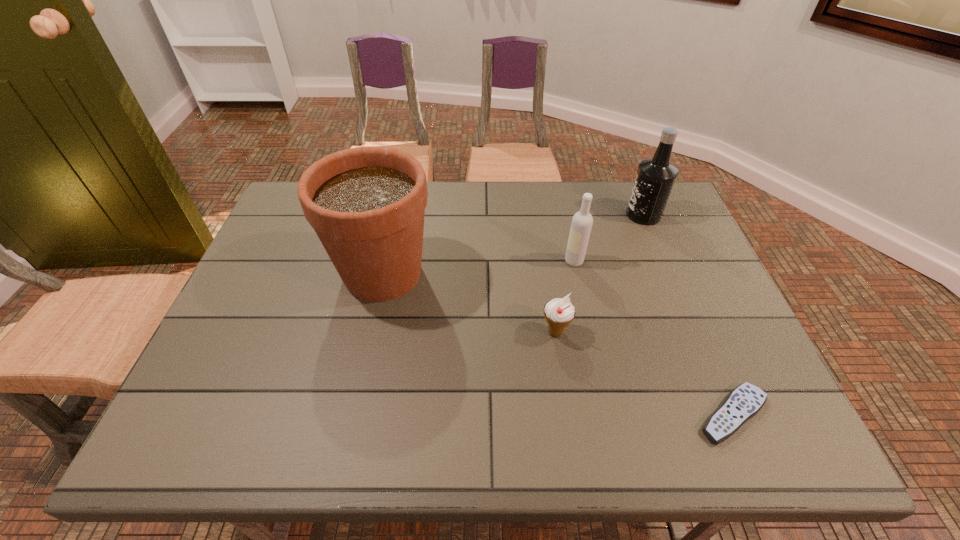
I want to click on vacant region located on the front label of the farthest object, so click(x=558, y=215).

Where is `free space located 0.150m on the front label of the farthest object`? Image resolution: width=960 pixels, height=540 pixels. free space located 0.150m on the front label of the farthest object is located at coordinates (577, 215).

This screenshot has height=540, width=960. Find the location of `vacant region located 0.350m on the back of the vodka`. vacant region located 0.350m on the back of the vodka is located at coordinates (558, 184).

The height and width of the screenshot is (540, 960). Identify the location of vacant area located 0.360m on the right of the fourth farthest object. (721, 332).

This screenshot has width=960, height=540. I want to click on vacant space situated on the left of the nearest object, so click(x=657, y=415).

The width and height of the screenshot is (960, 540). Find the location of `object present at the far edge`. object present at the far edge is located at coordinates (655, 177).

Where is `object situated at the near edge`? The height and width of the screenshot is (540, 960). object situated at the near edge is located at coordinates (745, 401).

Locate an element on the screen. liquor at the right edge is located at coordinates (655, 177).

In order to click on remote control situated at the right edge in this screenshot , I will do `click(745, 401)`.

Identify the location of object at the far right corner. [655, 177].